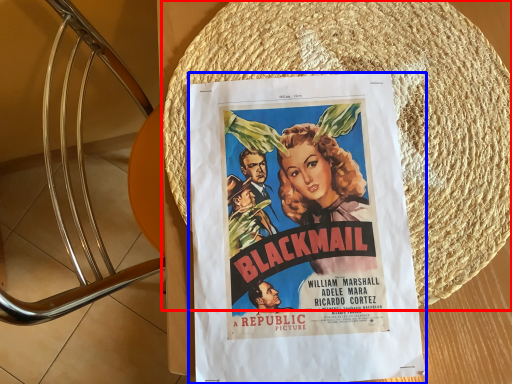
Question: Which object is further to the camera taking this photo, straw hat (highlighted by a red box) or poster (highlighted by a blue box)?

Choices:
 (A) straw hat
 (B) poster

Answer: (A)